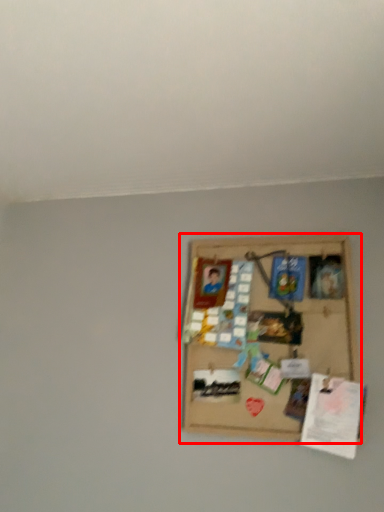
Question: Observing the image, what is the correct spatial positioning of picture frame (annotated by the red box) in reference to plaque?

Choices:
 (A) left
 (B) right

Answer: (A)